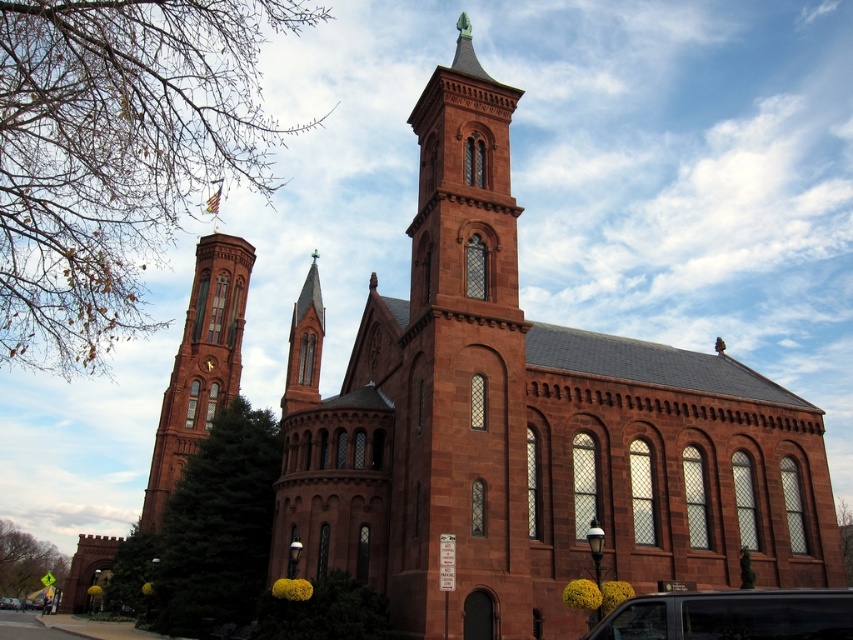
Is red stone tower at center bigger than matte brick tower at left?

No.

Identify the location of red stone tower at center. This screenshot has width=853, height=640. (462, 372).

Between point (462, 132) and point (184, 384), which one is positioned in front?

Point (462, 132) is in front.

Locate an element on the screen. red stone tower at center is located at coordinates (462, 372).

Can you confirm if matte brick tower at left is smaller than black matte van at lower right?

Incorrect, matte brick tower at left is not smaller in size than black matte van at lower right.

The image size is (853, 640). What do you see at coordinates (200, 364) in the screenshot? I see `matte brick tower at left` at bounding box center [200, 364].

Image resolution: width=853 pixels, height=640 pixels. Find the location of `matte brick tower at left`. matte brick tower at left is located at coordinates (200, 364).

Is red stone tower at center bigger than black matte van at lower right?

Yes.

What do you see at coordinates (462, 372) in the screenshot? The height and width of the screenshot is (640, 853). I see `red stone tower at center` at bounding box center [462, 372].

At what (x,y) coordinates should I click in order to perform the action: click on red stone tower at center. Please return your answer as a coordinate pair (x, y). Image resolution: width=853 pixels, height=640 pixels. Looking at the image, I should click on (462, 372).